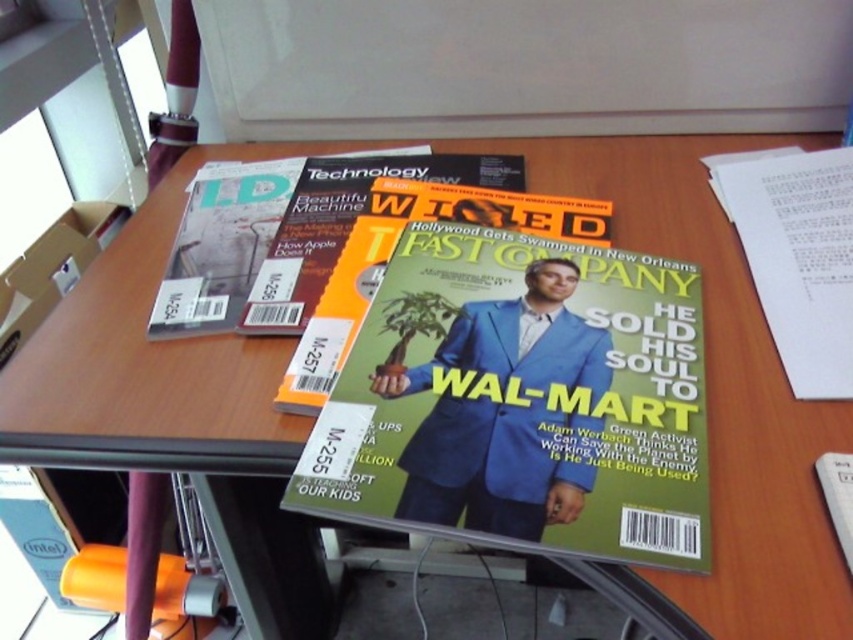
You are organizing a desk and need to place both the green matte magazine at center and the matte orange magazine at center into a drawer. The drawer can only accommodate one magazine at a time. Which magazine should you place first to ensure it fits?

The green matte magazine at center is larger in size than the matte orange magazine at center, so you should place the smaller matte orange magazine at center first to ensure it fits in the drawer before the larger one.

You are a photographer standing 20 inches away from a desk. You want to take a closeup photo of the green matte magazine at center. Can you get close enough to focus on it without moving your camera?

The green matte magazine at center is 17.52 inches away from the camera. Since you are standing 20 inches away from the desk, you need to move your camera 2.48 inches closer to the magazine to focus properly.

You are organizing a desk and see the blue fabric man at center and the matte orange magazine at center. Which object is positioned to the right of the other?

The blue fabric man at center is to the right of the matte orange magazine at center.